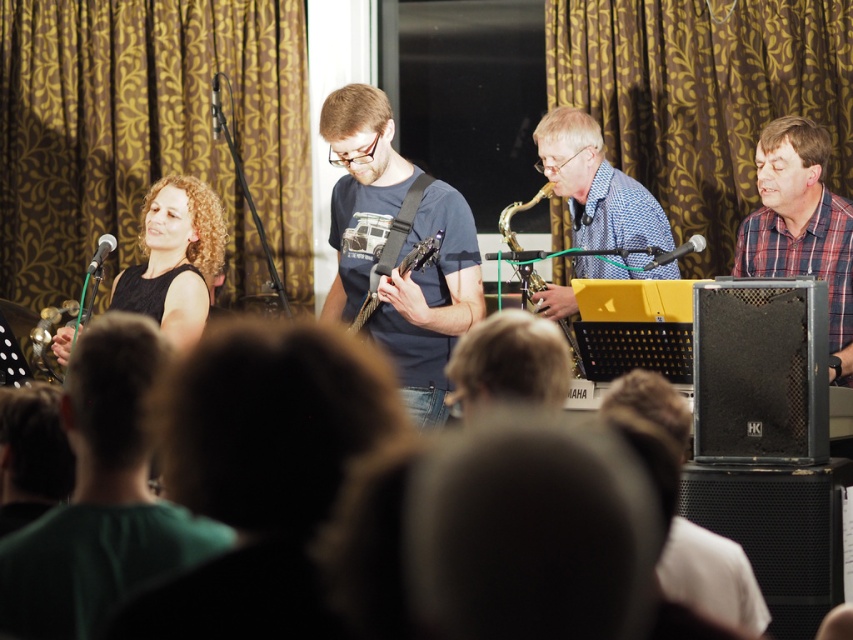
You are an event planner assessing the stage setup. You notice the green fabric shirt at left and the dark brown leather jacket at center. Which clothing item is positioned higher on the stage?

The green fabric shirt at left is taller than the dark brown leather jacket at center, so the green fabric shirt at left is positioned higher on the stage.